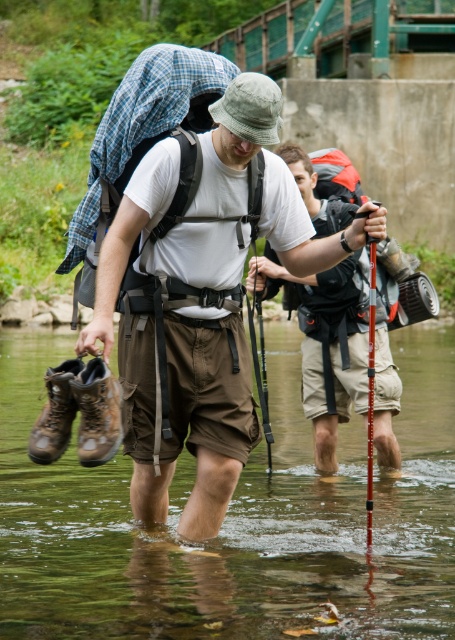
Who is positioned more to the left, matte khaki shorts at center or brown suede boot at lower left?

Positioned to the left is brown suede boot at lower left.

Is point (319, 420) positioned before point (101, 394)?

No, it is behind (101, 394).

Locate an element on the screen. This screenshot has height=640, width=455. matte khaki shorts at center is located at coordinates (323, 346).

Is the position of clear water at lower center more distant than that of brown leather boot at lower left?

No, it is in front of brown leather boot at lower left.

Can you confirm if clear water at lower center is wider than brown leather boot at lower left?

Indeed, clear water at lower center has a greater width compared to brown leather boot at lower left.

You are a GUI agent. You are given a task and a screenshot of the screen. Output one action in this format:
    pyautogui.click(x=<x>, y=<y>)
    Task: Click on the clear water at lower center
    
    Given the screenshot: What is the action you would take?
    pyautogui.click(x=233, y=518)

Can you confirm if brown suede boot at lower left is taller than brown leather boot at lower left?

Correct, brown suede boot at lower left is much taller as brown leather boot at lower left.

What do you see at coordinates (97, 412) in the screenshot? This screenshot has width=455, height=640. I see `brown suede boot at lower left` at bounding box center [97, 412].

Where is `brown suede boot at lower left`? The image size is (455, 640). brown suede boot at lower left is located at coordinates (97, 412).